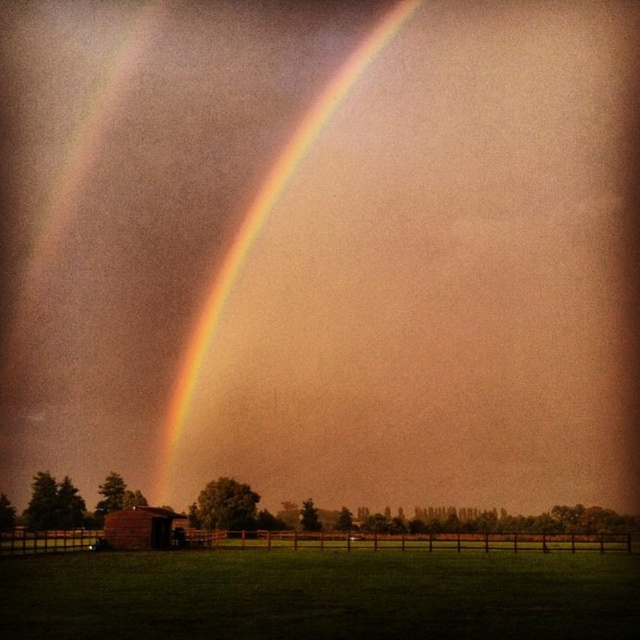
Is rainbow at upper center smaller than brown brick barn at lower left?

Incorrect, rainbow at upper center is not smaller in size than brown brick barn at lower left.

Locate an element on the screen. Image resolution: width=640 pixels, height=640 pixels. rainbow at upper center is located at coordinates (262, 224).

Can you confirm if green grass at lower center is bigger than rainbow at upper center?

Incorrect, green grass at lower center is not larger than rainbow at upper center.

Between green grass at lower center and rainbow at upper center, which one has less height?

Standing shorter between the two is green grass at lower center.

Does point (492, 596) lie in front of point (308, 122)?

Yes, point (492, 596) is in front of point (308, 122).

Locate an element on the screen. The width and height of the screenshot is (640, 640). green grass at lower center is located at coordinates (320, 595).

Who is more forward, (205, 554) or (157, 522)?

Positioned in front is point (205, 554).

Find the location of a particular element. green grass at lower center is located at coordinates (320, 595).